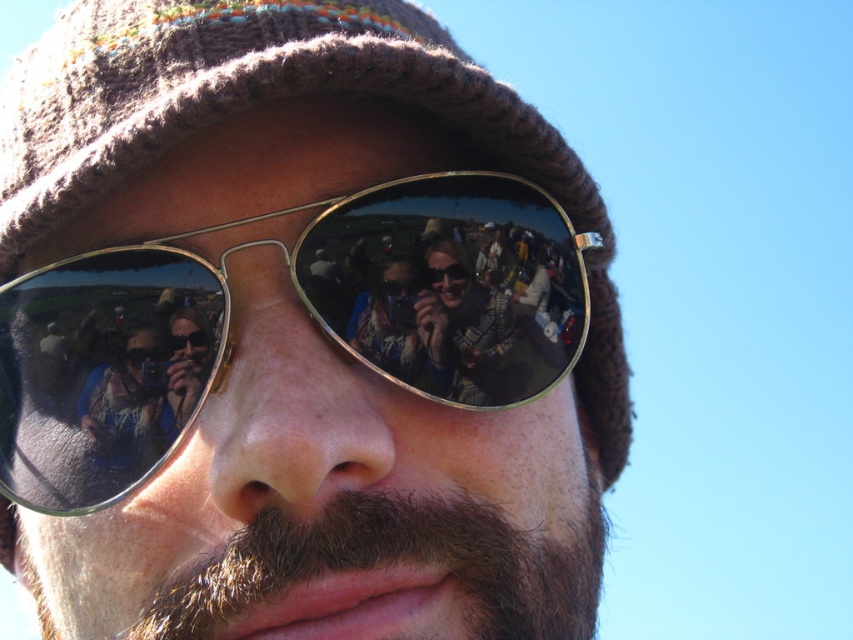
Between gold reflective sunglasses at center and plaid fabric shirt at center, which one is positioned higher?

plaid fabric shirt at center is higher up.

Can you confirm if gold reflective sunglasses at center is smaller than plaid fabric shirt at center?

Incorrect, gold reflective sunglasses at center is not smaller in size than plaid fabric shirt at center.

Which is behind, point (425, 260) or point (427, 253)?

The point (425, 260) is behind.

This screenshot has width=853, height=640. Find the location of `gold reflective sunglasses at center`. gold reflective sunglasses at center is located at coordinates (305, 308).

Is point (300, 572) more distant than point (479, 378)?

No, it is in front of (479, 378).

Between dark brown fuzzy beard at center and plaid fabric shirt at center, which one appears on the left side from the viewer's perspective?

dark brown fuzzy beard at center

Is point (337, 499) closer to camera compared to point (434, 273)?

Yes.

Locate an element on the screen. Image resolution: width=853 pixels, height=640 pixels. dark brown fuzzy beard at center is located at coordinates (393, 563).

This screenshot has width=853, height=640. Describe the element at coordinates (305, 308) in the screenshot. I see `gold reflective sunglasses at center` at that location.

Locate an element on the screen. The width and height of the screenshot is (853, 640). gold reflective sunglasses at center is located at coordinates (305, 308).

Locate an element on the screen. This screenshot has width=853, height=640. gold reflective sunglasses at center is located at coordinates (305, 308).